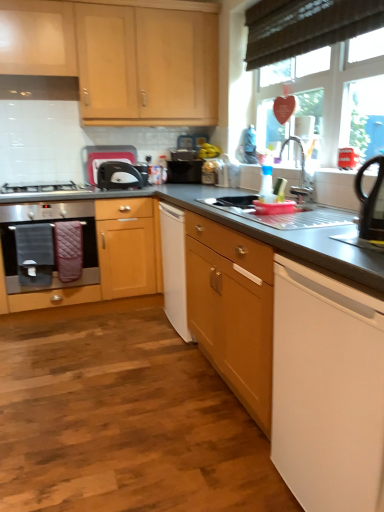
Identify the location of free space above wooden floor at lower left (from a real-world perspective). (112, 385).